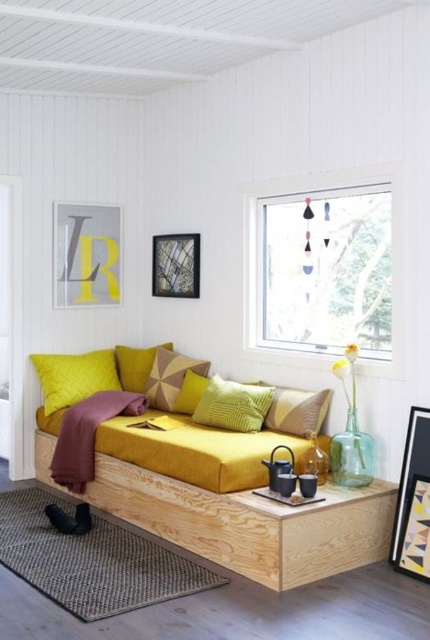
Between wooden picture frame at lower right and velvet yellow pillow at center, which one has more height?

wooden picture frame at lower right is taller.

Which is behind, point (404, 531) or point (82, 364)?

Point (82, 364)

This screenshot has height=640, width=430. In order to click on wooden picture frame at lower right in this screenshot , I will do `click(412, 497)`.

Is point (298, 428) positioned behind point (154, 388)?

No, it is not.

Identify the location of textured beige pillow at center. The width and height of the screenshot is (430, 640). (297, 410).

You are a GUI agent. You are given a task and a screenshot of the screen. Output one action in this format:
    pyautogui.click(x=<x>, y=<y>)
    Task: Click on the textured beige pillow at center
    
    Given the screenshot: What is the action you would take?
    pyautogui.click(x=297, y=410)

Who is more distant from viewer, [402,515] or [292,396]?

Positioned behind is point [292,396].

Who is lower down, wooden picture frame at lower right or textured beige pillow at center?

wooden picture frame at lower right is below.

This screenshot has height=640, width=430. Find the location of `wooden picture frame at lower right`. wooden picture frame at lower right is located at coordinates (412, 497).

The width and height of the screenshot is (430, 640). Identify the location of wooden picture frame at lower right. (412, 497).